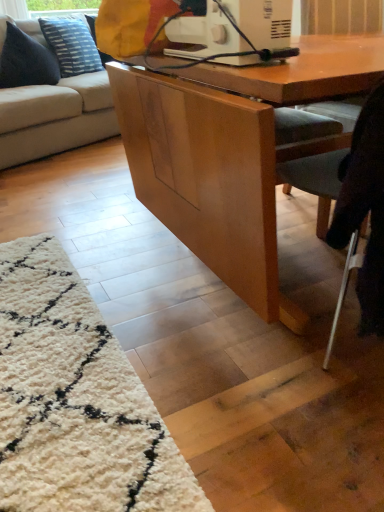
Question: Is blue textured pillow at upper left, the second pillow when ordered from front to back, wider than dark blue fabric pillow at upper left, which ranks as the 1th pillow in front-to-back order?

Choices:
 (A) yes
 (B) no

Answer: (A)

Question: Is blue textured pillow at upper left, the first pillow from the back, further to the viewer compared to dark blue fabric pillow at upper left, which ranks as the second pillow in back-to-front order?

Choices:
 (A) yes
 (B) no

Answer: (A)

Question: Is blue textured pillow at upper left, the first pillow from the back, bigger than dark blue fabric pillow at upper left, which ranks as the second pillow in back-to-front order?

Choices:
 (A) yes
 (B) no

Answer: (A)

Question: Is the position of blue textured pillow at upper left, the second pillow when ordered from front to back, less distant than that of dark blue fabric pillow at upper left, which ranks as the second pillow in back-to-front order?

Choices:
 (A) no
 (B) yes

Answer: (A)

Question: Does blue textured pillow at upper left, the first pillow from the back, turn towards dark blue fabric pillow at upper left, which ranks as the 1th pillow in front-to-back order?

Choices:
 (A) yes
 (B) no

Answer: (B)

Question: Is blue textured pillow at upper left, the second pillow when ordered from front to back, smaller than dark blue fabric pillow at upper left, which ranks as the second pillow in back-to-front order?

Choices:
 (A) no
 (B) yes

Answer: (A)

Question: Can you confirm if beige fabric couch at left is smaller than light gray fabric chair at lower right?

Choices:
 (A) yes
 (B) no

Answer: (B)

Question: Does beige fabric couch at left come behind light gray fabric chair at lower right?

Choices:
 (A) yes
 (B) no

Answer: (A)

Question: Is beige fabric couch at left aimed at light gray fabric chair at lower right?

Choices:
 (A) no
 (B) yes

Answer: (B)

Question: Considering the relative sizes of beige fabric couch at left and light gray fabric chair at lower right in the image provided, is beige fabric couch at left wider than light gray fabric chair at lower right?

Choices:
 (A) yes
 (B) no

Answer: (A)

Question: Can you confirm if beige fabric couch at left is positioned to the left of light gray fabric chair at lower right?

Choices:
 (A) yes
 (B) no

Answer: (A)

Question: Is beige fabric couch at left at the right side of light gray fabric chair at lower right?

Choices:
 (A) yes
 (B) no

Answer: (B)

Question: From the image's perspective, is light gray fabric chair at lower right on top of dark blue fabric pillow at upper left, which ranks as the second pillow in back-to-front order?

Choices:
 (A) no
 (B) yes

Answer: (A)